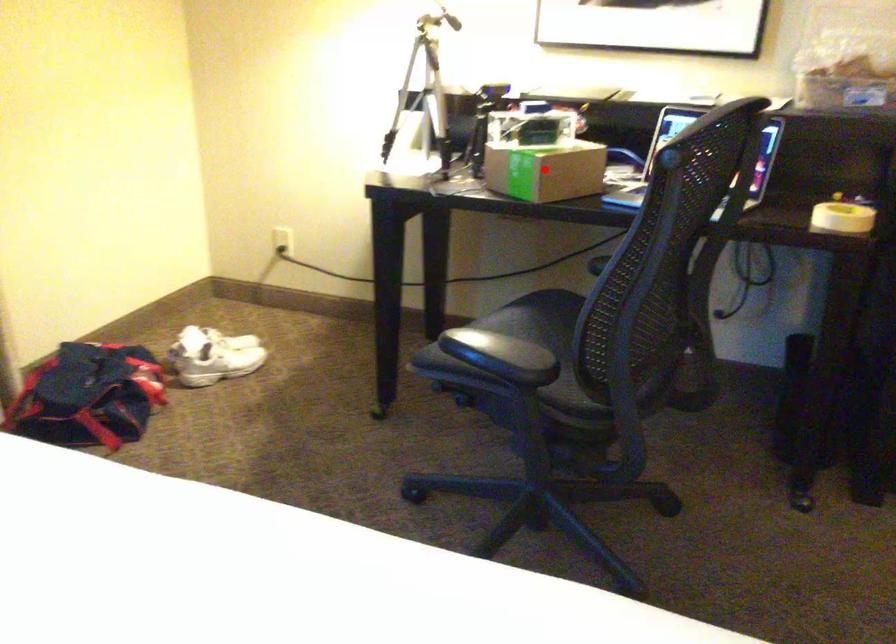
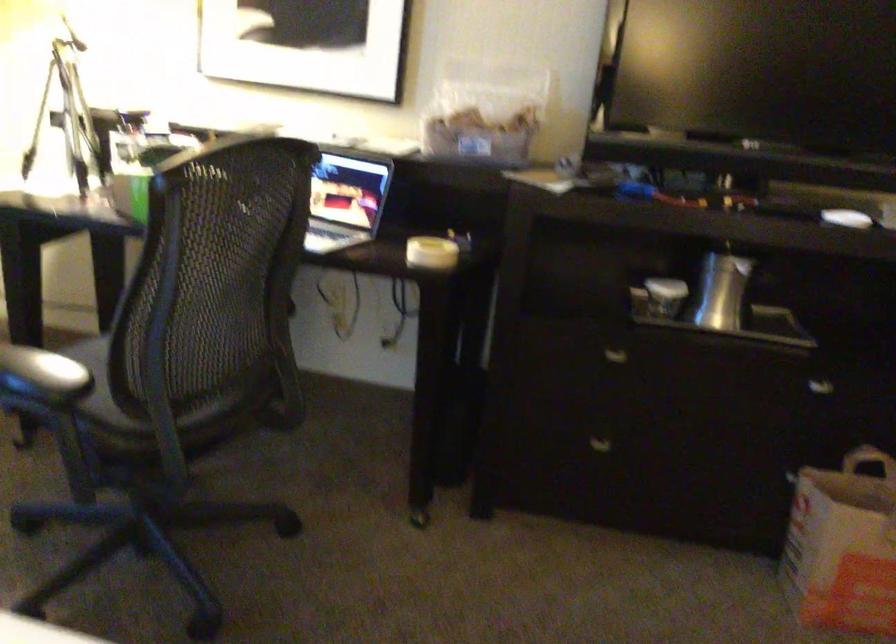
Question: I am providing you with two images of the same scene from different viewpoints. A red point is marked on the first image. At the location where the point appears in image 1, is it still visible in image 2?

Choices:
 (A) Yes
 (B) No

Answer: (B)